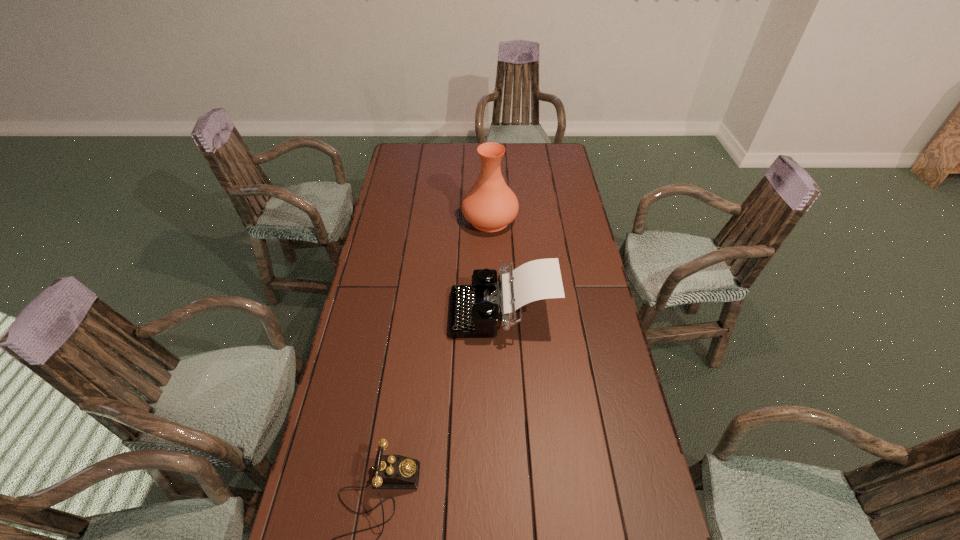
The height and width of the screenshot is (540, 960). I want to click on the farthest object, so click(x=490, y=205).

The height and width of the screenshot is (540, 960). Find the location of `the tallest object`. the tallest object is located at coordinates (490, 205).

In order to click on the second shortest object in this screenshot , I will do `click(475, 309)`.

This screenshot has height=540, width=960. In order to click on typewriter in this screenshot , I will do `click(475, 309)`.

Find the location of a particular element. The image size is (960, 540). vacant space located 0.200m on the front of the vase is located at coordinates (492, 274).

You are a GUI agent. You are given a task and a screenshot of the screen. Output one action in this format:
    pyautogui.click(x=<x>, y=<y>)
    Task: Click on the free region located on the keys of the second nearest object
    Image resolution: width=960 pixels, height=540 pixels.
    Given the screenshot: What is the action you would take?
    pos(397,312)

Identify the location of vacant space located 0.290m on the keys of the second nearest object. (365, 312).

Locate an element on the screen. Image resolution: width=960 pixels, height=540 pixels. vacant region located 0.070m on the keys of the second nearest object is located at coordinates (430, 312).

Find the location of a particular element. This screenshot has height=540, width=960. blank space at the left edge of the desktop is located at coordinates (331, 532).

Identify the location of free space at the right edge of the desktop. (618, 464).